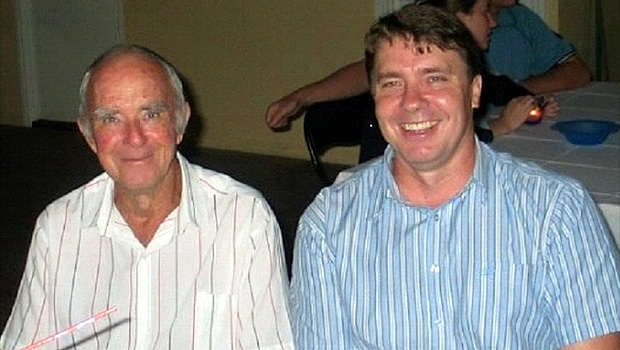
I want to click on chair, so click(x=328, y=124).